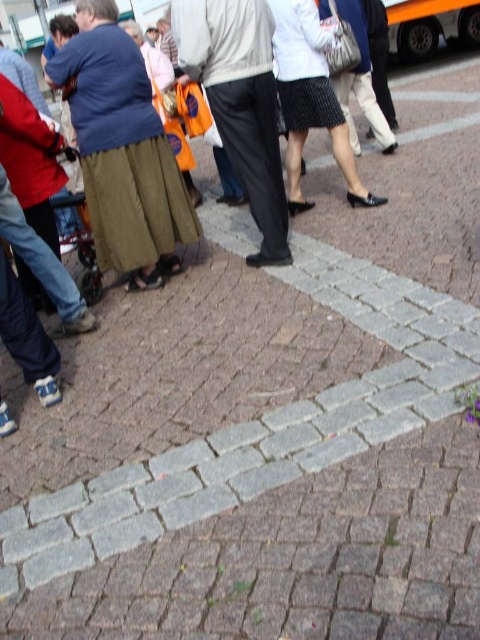
Describe the element at coordinates (122, 150) in the screenshot. I see `matte olive skirt at left` at that location.

Which is more to the right, matte olive skirt at left or black textured skirt at center?

black textured skirt at center

Identify the location of matte olive skirt at left. coord(122,150).

Where is `matte olive skirt at left`? Image resolution: width=480 pixels, height=640 pixels. matte olive skirt at left is located at coordinates [x=122, y=150].

Does matte olive skirt at left have a greater height compared to dark gray pants at center?

Yes, matte olive skirt at left is taller than dark gray pants at center.

Is matte olive skirt at left bigger than dark gray pants at center?

Indeed, matte olive skirt at left has a larger size compared to dark gray pants at center.

Who is more forward, (146, 122) or (223, 140)?

Point (146, 122) is more forward.

The image size is (480, 640). I want to click on matte olive skirt at left, so click(x=122, y=150).

Can you confirm if dark gray pants at center is positioned to the right of black textured skirt at center?

Incorrect, dark gray pants at center is not on the right side of black textured skirt at center.

Where is `dark gray pants at center`? The width and height of the screenshot is (480, 640). dark gray pants at center is located at coordinates (240, 104).